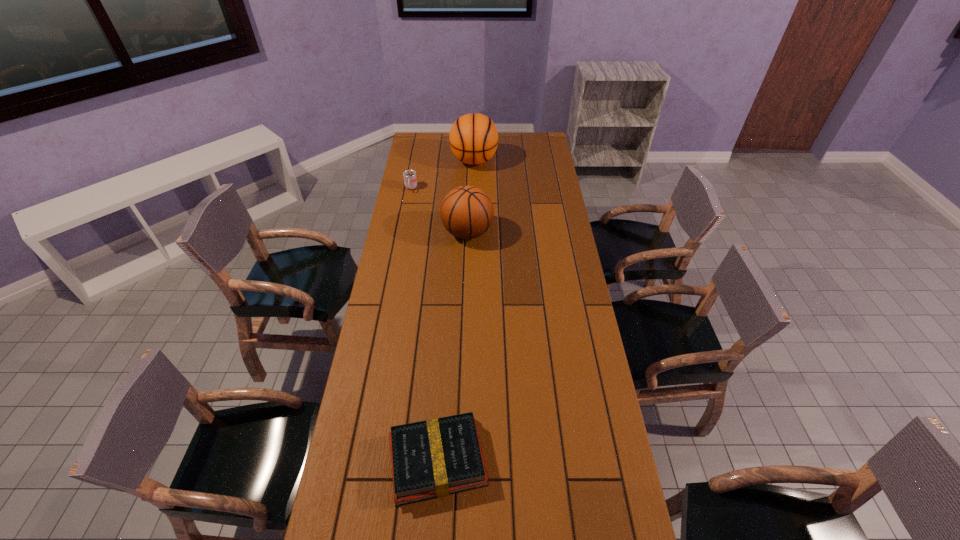
The image size is (960, 540). In order to click on object that is at the far edge in this screenshot , I will do `click(473, 138)`.

Locate an element on the screen. Image resolution: width=960 pixels, height=540 pixels. cup positioned at the left edge is located at coordinates (410, 181).

The width and height of the screenshot is (960, 540). I want to click on hardback book situated at the left edge, so click(x=434, y=458).

Find the location of `free space at the left edge`. free space at the left edge is located at coordinates (415, 209).

Locate an element on the screen. Image resolution: width=960 pixels, height=540 pixels. vacant region at the right edge of the desktop is located at coordinates (583, 295).

Identify the location of vacant area between the farther basketball and the shortest object. (456, 310).

Where is `vacant region between the leftmost object and the nearer basketball`? vacant region between the leftmost object and the nearer basketball is located at coordinates (440, 210).

The width and height of the screenshot is (960, 540). What are the coordinates of `free space between the farthest object and the third tallest object` in the screenshot? It's located at pyautogui.click(x=443, y=174).

Locate an element on the screen. This screenshot has width=960, height=540. vacant region between the nearer basketball and the shortest object is located at coordinates (453, 346).

Where is `vacant area between the third farthest object and the hardback book`? Image resolution: width=960 pixels, height=540 pixels. vacant area between the third farthest object and the hardback book is located at coordinates (453, 346).